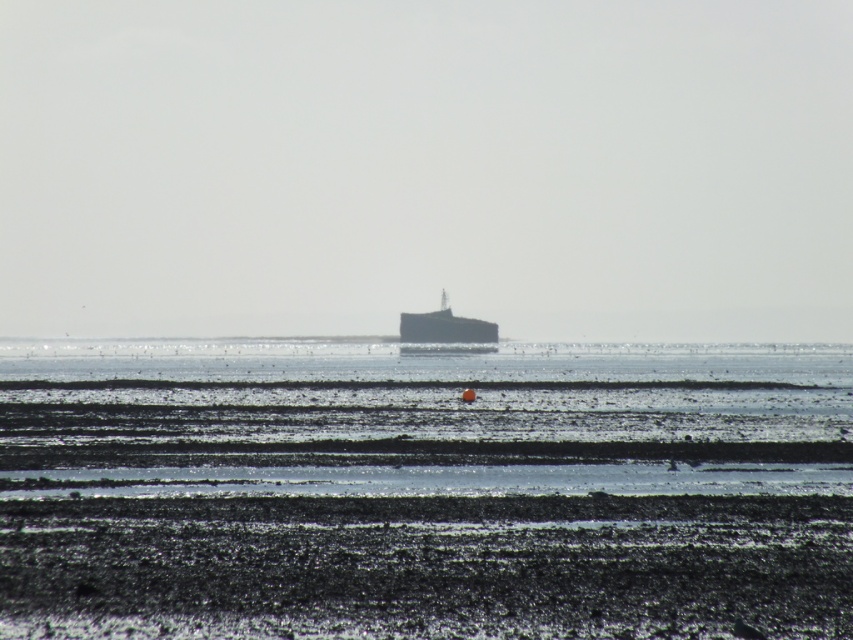
What are the coordinates of `clear water at center` in the screenshot? It's located at (415, 362).

Is clear water at center closer to the viewer compared to dark gray metallic boat at center?

Yes, it is.

At what (x,y) coordinates should I click in order to perform the action: click on clear water at center. Please return your answer as a coordinate pair (x, y). Image resolution: width=853 pixels, height=640 pixels. Looking at the image, I should click on (415, 362).

Who is more distant from viewer, (704, 552) or (466, 317)?

The point (466, 317) is behind.

Is black matte mud at lower center thinner than dark gray metallic boat at center?

No, black matte mud at lower center is not thinner than dark gray metallic boat at center.

Describe the element at coordinates (426, 566) in the screenshot. I see `black matte mud at lower center` at that location.

The width and height of the screenshot is (853, 640). Identify the location of black matte mud at lower center. (426, 566).

Does black matte mud at lower center have a larger size compared to clear water at center?

Incorrect, black matte mud at lower center is not larger than clear water at center.

Does black matte mud at lower center have a lesser width compared to clear water at center?

Indeed, black matte mud at lower center has a lesser width compared to clear water at center.

Is point (471, 620) closer to camera compared to point (705, 378)?

Yes.

Locate an element on the screen. black matte mud at lower center is located at coordinates click(426, 566).